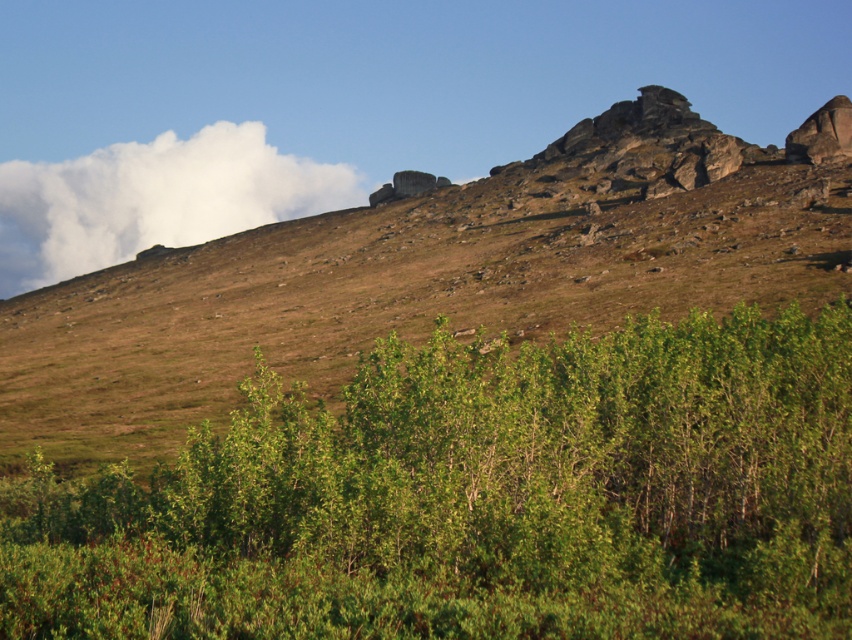
You are an airplane passenger looking out the window and see the rugged stone mountain at upper center and the white fluffy cloud at upper left. Which object is located more to the right side?

The rugged stone mountain at upper center is positioned more to the right side than the white fluffy cloud at upper left.

You are standing at the viewpoint overlooking the landscape. You notice two points marked on the image. The first point is at coordinate point (850,605) and the second is at coordinate point (235,285). Which of these two points is closer to you based on their positions in the scene?

Point (850,605) is in front of point (235,285), so it is closer to you.

You are planning to set up a small tent for a camping trip. You have two options for locations in the image provided. The first is near the green leafy shrubs at lower center, and the second is near the rugged stone mountain at upper center. Considering the width of the areas, which location would provide more space for your tent?

The rugged stone mountain at upper center has a greater width compared to the green leafy shrubs at lower center, so setting up the tent near the rugged stone mountain at upper center would provide more space.